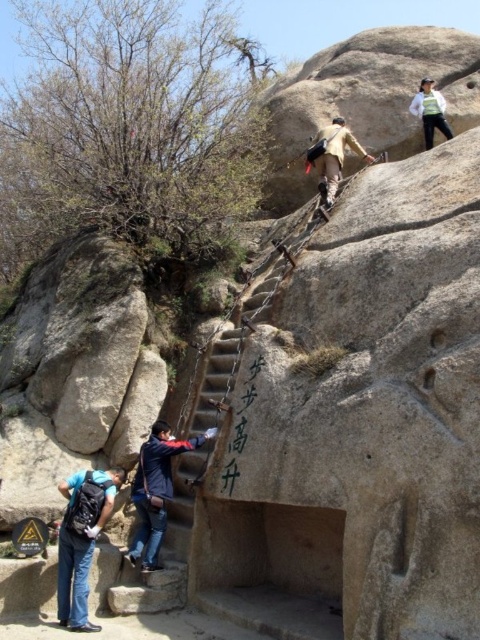
Question: Which of the following is the farthest from the observer?

Choices:
 (A) (170, 490)
 (B) (74, 595)

Answer: (A)

Question: Where is matte black backpack at lower left located in relation to beige fabric jacket at center in the image?

Choices:
 (A) right
 (B) left

Answer: (B)

Question: Among these points, which one is nearest to the camera?

Choices:
 (A) (440, 104)
 (B) (335, 168)
 (C) (79, 506)
 (D) (140, 548)

Answer: (C)

Question: From the image, what is the correct spatial relationship of matte black backpack at lower left in relation to dark blue jacket at center?

Choices:
 (A) below
 (B) above

Answer: (A)

Question: Estimate the real-world distances between objects in this image. Which object is closer to the white matte jacket at upper right?

Choices:
 (A) beige fabric jacket at center
 (B) matte black backpack at lower left

Answer: (A)

Question: Is matte black backpack at lower left smaller than beige fabric jacket at center?

Choices:
 (A) yes
 (B) no

Answer: (B)